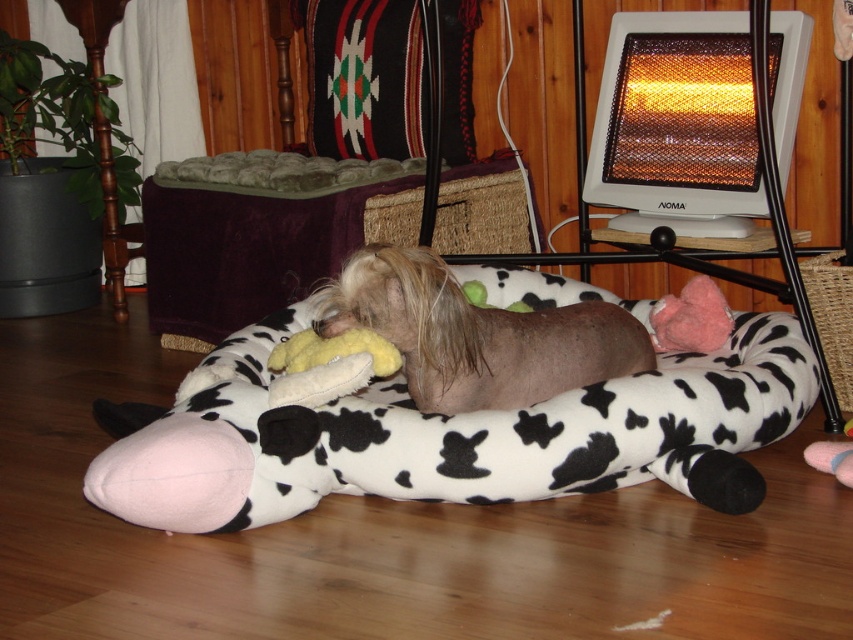
You are a small robot navigating the room. You need to move from the point at coordinates point (129, 412) to the point at coordinates point (325, 216). According to the scene, which direction should you move to reach your destination?

To move from point (129, 412) to point (325, 216), you should move backward because point (129, 412) is in front of point (325, 216).